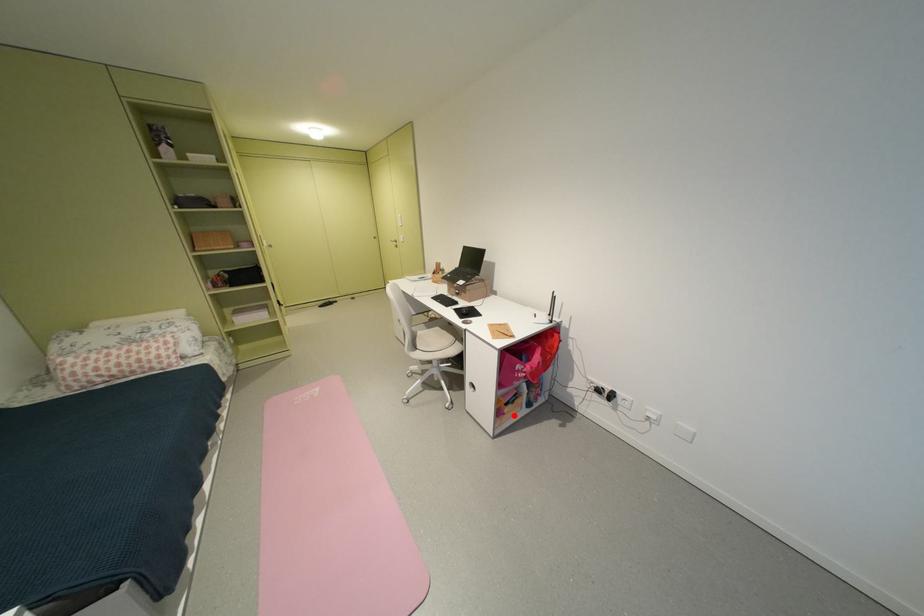
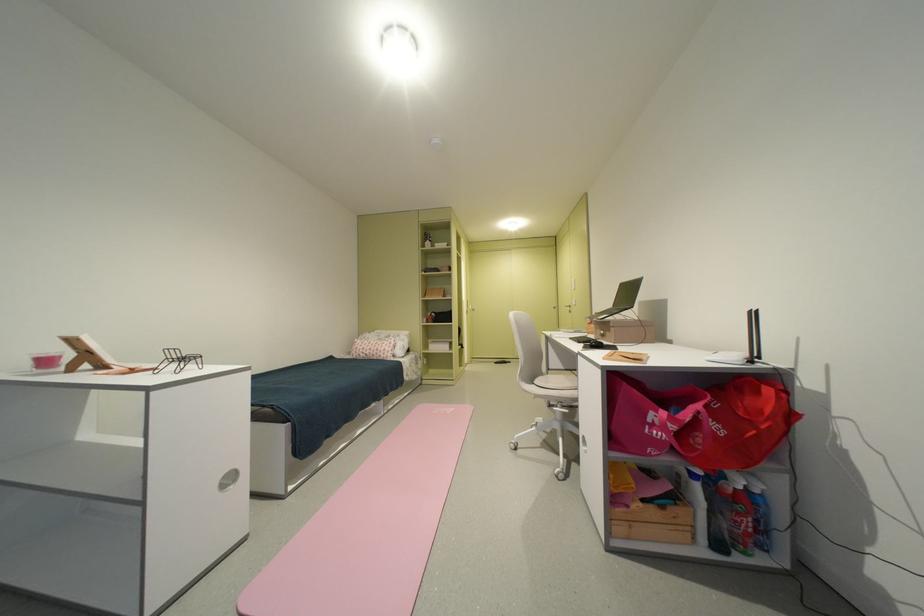
Question: I am providing you with two images of the same scene from different viewpoints. Image1 has a red point marked. In image2, the corresponding 3D location appears at what relative position? Reply with the corresponding letter.

Choices:
 (A) Closer
 (B) Farther

Answer: (A)